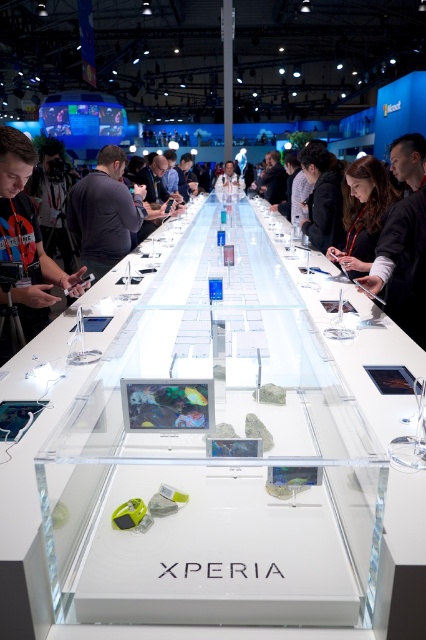
Question: Does black fabric shirt at upper center appear under matte black laptop at upper center?

Choices:
 (A) no
 (B) yes

Answer: (B)

Question: Can you confirm if dark gray fabric shirt at left is smaller than black fabric person at center?

Choices:
 (A) no
 (B) yes

Answer: (B)

Question: Which point appears farthest from the camera in this image?

Choices:
 (A) (409, 166)
 (B) (129, 243)
 (C) (230, 188)

Answer: (C)

Question: Which is farther from the matte black laptop at upper center?

Choices:
 (A) matte black laptop at center
 (B) black fabric jacket at center
 (C) black fabric person at center

Answer: (C)

Question: Considering the relative positions of matte black laptop at upper center and black fabric person at center in the image provided, where is matte black laptop at upper center located with respect to black fabric person at center?

Choices:
 (A) left
 (B) right

Answer: (B)

Question: Which point is closer to the camera?

Choices:
 (A) (81, 180)
 (B) (377, 216)

Answer: (B)